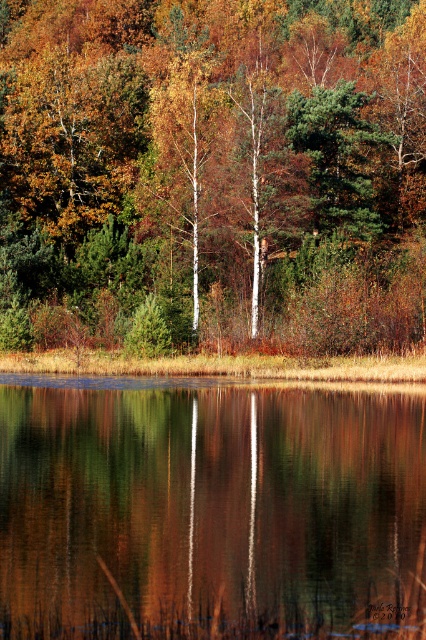
Which of these two, green reflective water at center or white smooth birch tree at center, stands taller?

Standing taller between the two is white smooth birch tree at center.

Does green reflective water at center have a greater height compared to white smooth birch tree at center?

No.

Between point (74, 582) and point (169, 118), which one is positioned in front?

Point (74, 582) is in front.

Locate an element on the screen. This screenshot has height=640, width=426. green reflective water at center is located at coordinates (210, 513).

Between autumn leaves at center and white smooth birch tree at center, which one is positioned lower?

Positioned lower is white smooth birch tree at center.

Is autumn leaves at center positioned in front of white smooth birch tree at center?

Yes, it is.

Measure the distance between point [69,29] and camera.

They are 108.80 meters apart.

Where is `autumn leaves at center`? The height and width of the screenshot is (640, 426). autumn leaves at center is located at coordinates (215, 170).

Is the position of green reflective water at center less distant than that of green matte tree at center?

Yes, it is.

Does point (3, 579) lie in front of point (345, 232)?

Yes, it is.

This screenshot has height=640, width=426. I want to click on green reflective water at center, so click(x=210, y=513).